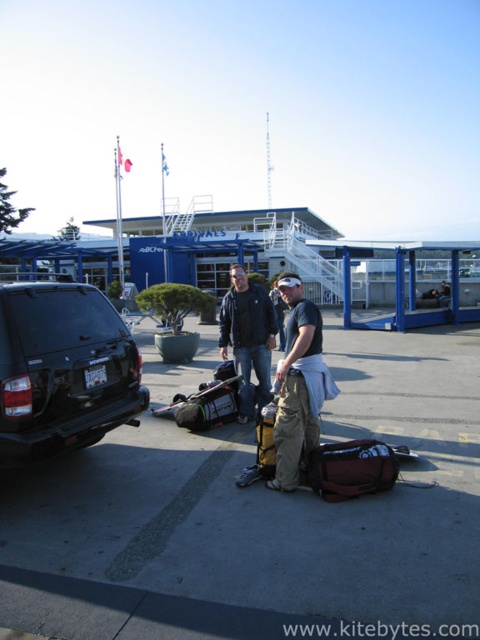
You are a visitor at the marina and need to park your car. You see a black rubber car at lower left and a matte black jacket at center. Which object is closer to the left side of the parking area?

The black rubber car at lower left is closer to the left side of the parking area because it is positioned to the left of the matte black jacket at center.

You are a delivery person trying to park your vehicle in the marina parking lot. You see the black rubber car at lower left and the black matte suv at left. Which vehicle is closer to you, and would you have enough space to maneuver around it?

The black rubber car at lower left is closer to you than the black matte suv at left. Since the black rubber car is closer, you should ensure there is sufficient space between it and the suv to maneuver safely.

You are a delivery person trying to park your vehicle in a spot that requires backing into a space. You see the black matte suv at left and the matte black jacket at center. Which object is closer to the ground?

The black matte suv at left is closer to the ground because it is positioned below the matte black jacket at center.